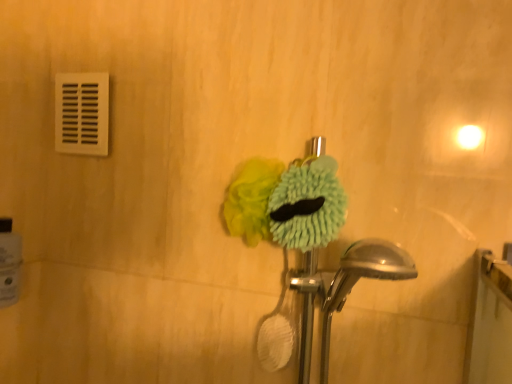
Question: Is white glossy toilet paper at lower left oriented away from green fuzzy brush at center, the 1th flower viewed from the right?

Choices:
 (A) no
 (B) yes

Answer: (A)

Question: Does white glossy toilet paper at lower left turn towards green fuzzy brush at center, the 1th flower viewed from the right?

Choices:
 (A) yes
 (B) no

Answer: (A)

Question: From the image's perspective, is white glossy toilet paper at lower left located above green fuzzy brush at center, the 1th flower viewed from the right?

Choices:
 (A) yes
 (B) no

Answer: (B)

Question: From a real-world perspective, is white glossy toilet paper at lower left located higher than green fuzzy brush at center, the 1th flower viewed from the right?

Choices:
 (A) no
 (B) yes

Answer: (A)

Question: Considering the relative sizes of white glossy toilet paper at lower left and green fuzzy brush at center, the second flower when ordered from left to right, in the image provided, is white glossy toilet paper at lower left shorter than green fuzzy brush at center, the second flower when ordered from left to right,?

Choices:
 (A) no
 (B) yes

Answer: (A)

Question: Considering their positions, is soft yellow sponge at center, the 1th flower positioned from the left, located in front of or behind white plastic vent at upper left?

Choices:
 (A) front
 (B) behind

Answer: (A)

Question: Choose the correct answer: Is soft yellow sponge at center, acting as the second flower starting from the right, inside white plastic vent at upper left or outside it?

Choices:
 (A) inside
 (B) outside

Answer: (B)

Question: Is soft yellow sponge at center, the 1th flower positioned from the left, to the left or to the right of white plastic vent at upper left in the image?

Choices:
 (A) right
 (B) left

Answer: (A)

Question: From a real-world perspective, is soft yellow sponge at center, acting as the second flower starting from the right, physically located above or below white plastic vent at upper left?

Choices:
 (A) above
 (B) below

Answer: (B)

Question: From a real-world perspective, is white glossy toilet paper at lower left positioned above or below green fuzzy brush at center, the 1th flower viewed from the right?

Choices:
 (A) above
 (B) below

Answer: (B)

Question: Considering the relative positions of white glossy toilet paper at lower left and green fuzzy brush at center, the 1th flower viewed from the right, in the image provided, is white glossy toilet paper at lower left to the left or to the right of green fuzzy brush at center, the 1th flower viewed from the right,?

Choices:
 (A) left
 (B) right

Answer: (A)

Question: From the image's perspective, relative to green fuzzy brush at center, the second flower when ordered from left to right, is white glossy toilet paper at lower left above or below?

Choices:
 (A) below
 (B) above

Answer: (A)

Question: Considering the positions of point (10, 258) and point (344, 210), is point (10, 258) closer or farther from the camera than point (344, 210)?

Choices:
 (A) farther
 (B) closer

Answer: (A)

Question: From a real-world perspective, is soft yellow sponge at center, the 1th flower positioned from the left, above or below green fuzzy brush at center, the second flower when ordered from left to right?

Choices:
 (A) below
 (B) above

Answer: (A)

Question: Considering the positions of soft yellow sponge at center, acting as the second flower starting from the right, and green fuzzy brush at center, the second flower when ordered from left to right, in the image, is soft yellow sponge at center, acting as the second flower starting from the right, wider or thinner than green fuzzy brush at center, the second flower when ordered from left to right,?

Choices:
 (A) thin
 (B) wide

Answer: (B)